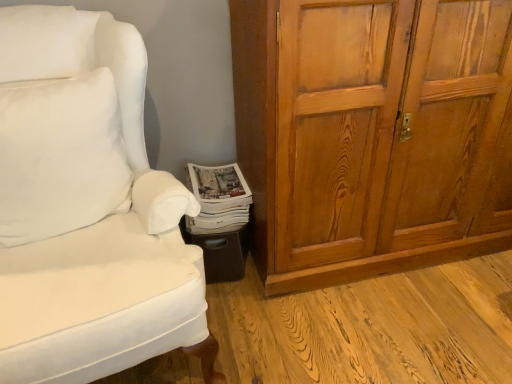
Question: Is white soft pillow at left taller or shorter than wooden cabinet at right?

Choices:
 (A) tall
 (B) short

Answer: (B)

Question: In terms of width, does white soft pillow at left look wider or thinner when compared to wooden cabinet at right?

Choices:
 (A) wide
 (B) thin

Answer: (B)

Question: Which of these objects is positioned farthest from the wooden cabinet at right?

Choices:
 (A) white glossy magazine at lower center
 (B) white fabric chair at lower left
 (C) white soft pillow at left

Answer: (C)

Question: Which object is positioned farthest from the white soft pillow at left?

Choices:
 (A) white glossy magazine at lower center
 (B) wooden cabinet at right
 (C) white fabric chair at lower left

Answer: (B)